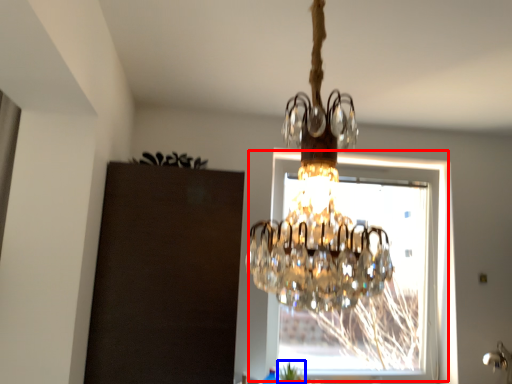
Question: Which object appears farthest to the camera in this image, window (highlighted by a red box) or plant (highlighted by a blue box)?

Choices:
 (A) window
 (B) plant

Answer: (A)